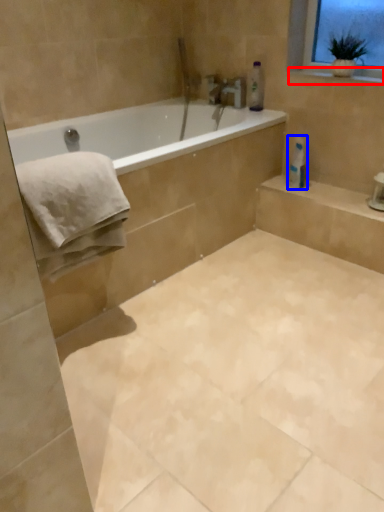
Question: Which object appears closest to the camera in this image, window sill (highlighted by a red box) or toilet paper (highlighted by a blue box)?

Choices:
 (A) window sill
 (B) toilet paper

Answer: (A)